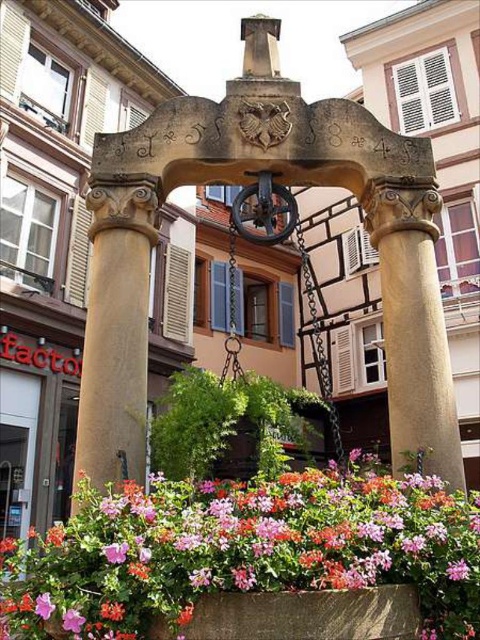
Question: Does pink matte flower at center have a smaller size compared to matte stone flower box at lower center?

Choices:
 (A) yes
 (B) no

Answer: (B)

Question: Observing the image, what is the correct spatial positioning of brown stone column at left in reference to matte stone flower box at lower center?

Choices:
 (A) below
 (B) above

Answer: (B)

Question: Among these points, which one is nearest to the camera?

Choices:
 (A) (122, 376)
 (B) (347, 611)
 (C) (249, 572)

Answer: (C)

Question: Can you confirm if brown stone column at left is wider than matte stone flower box at lower center?

Choices:
 (A) no
 (B) yes

Answer: (A)

Question: Among these objects, which one is nearest to the camera?

Choices:
 (A) smooth stone column at center
 (B) brown stone column at left
 (C) matte stone flower box at lower center

Answer: (C)

Question: Considering the real-world distances, which object is closest to the brown stone column at left?

Choices:
 (A) smooth stone column at center
 (B) pink matte flower at center
 (C) matte stone flower box at lower center

Answer: (B)